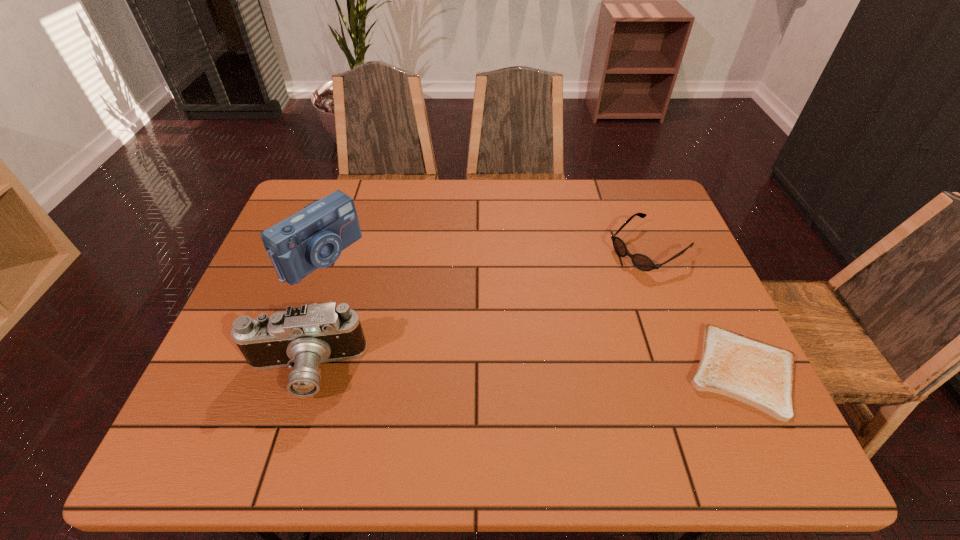
In the image, there is a desktop. Where is `vacant space at the near edge`? The width and height of the screenshot is (960, 540). vacant space at the near edge is located at coordinates (455, 379).

The height and width of the screenshot is (540, 960). Find the location of `free region at the left edge of the desktop`. free region at the left edge of the desktop is located at coordinates (263, 273).

I want to click on free space at the near left corner of the desktop, so click(x=236, y=404).

Identify the location of free spot between the nearer camera and the sunglasses. (477, 309).

This screenshot has height=540, width=960. I want to click on free area in between the sunglasses and the shortest object, so click(x=696, y=310).

Identify the location of free point between the farther camera and the toast. (532, 313).

This screenshot has width=960, height=540. In order to click on vacant space that is in between the toast and the sunglasses in this screenshot , I will do `click(696, 310)`.

You are a GUI agent. You are given a task and a screenshot of the screen. Output one action in this format:
    pyautogui.click(x=<x>, y=<y>)
    Task: Click on the vacant area that lies between the second shortest object and the toast
    
    Given the screenshot: What is the action you would take?
    pyautogui.click(x=696, y=310)

Find the location of a particular element. empty space that is in between the farther camera and the second shortest object is located at coordinates (485, 252).

You are a GUI agent. You are given a task and a screenshot of the screen. Output one action in this format:
    pyautogui.click(x=<x>, y=<y>)
    Task: Click on the vacant area that lies between the nearer camera and the sunglasses
    The height and width of the screenshot is (540, 960).
    Given the screenshot: What is the action you would take?
    pyautogui.click(x=477, y=309)